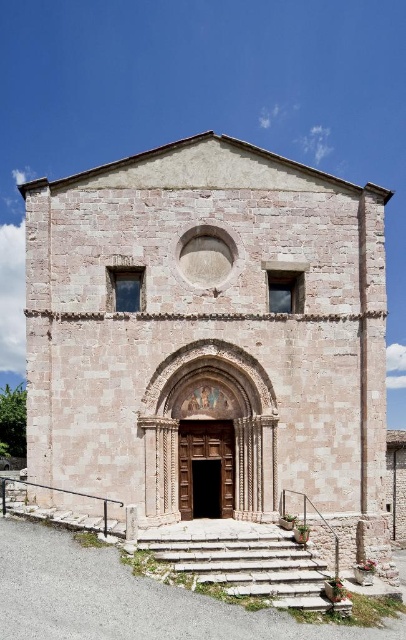
You are standing in front of the historic stone church and want to enter through the brown wooden door at center. Can you step onto the stone steps at lower center to reach the door?

The stone steps at lower center is taller than brown wooden door at center, so stepping onto the stone steps at lower center would not allow you to reach the door since the steps are higher than the door itself.

You are standing at the base of the stone steps at lower center and want to enter the brown wooden door at center. Which direction should you move to reach the door?

You should move upward along the stone steps at lower center to reach the brown wooden door at center since it is located above the steps.